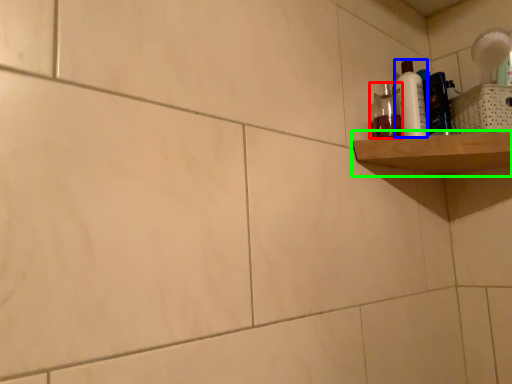
Question: Estimate the real-world distances between objects in this image. Which object is closer to mouthwash (highlighted by a red box), cleaning product (highlighted by a blue box) or shelf (highlighted by a green box)?

Choices:
 (A) cleaning product
 (B) shelf

Answer: (A)